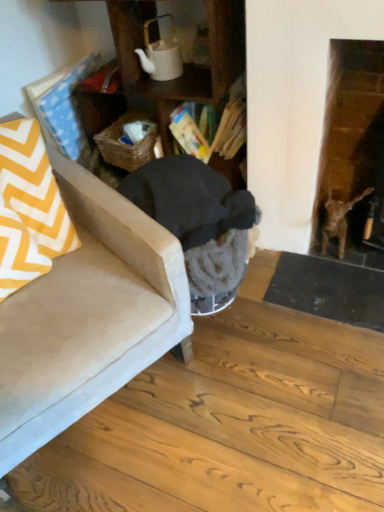
Question: Considering the positions of yellow and white zigzag fabric at left and woven brown basket at center in the image, is yellow and white zigzag fabric at left taller or shorter than woven brown basket at center?

Choices:
 (A) tall
 (B) short

Answer: (A)

Question: Considering their positions, is yellow and white zigzag fabric at left located in front of or behind woven brown basket at center?

Choices:
 (A) behind
 (B) front

Answer: (B)

Question: Based on their relative distances, which object is farther from the suede beige chair at lower left?

Choices:
 (A) yellow and white zigzag fabric at left
 (B) white matte teapot at upper center
 (C) woven brown basket at center
 (D) wooden cabinet at center

Answer: (B)

Question: Which object is positioned farthest from the suede beige chair at lower left?

Choices:
 (A) woven brown basket at center
 (B) wooden cabinet at center
 (C) white matte teapot at upper center
 (D) yellow and white zigzag fabric at left

Answer: (C)